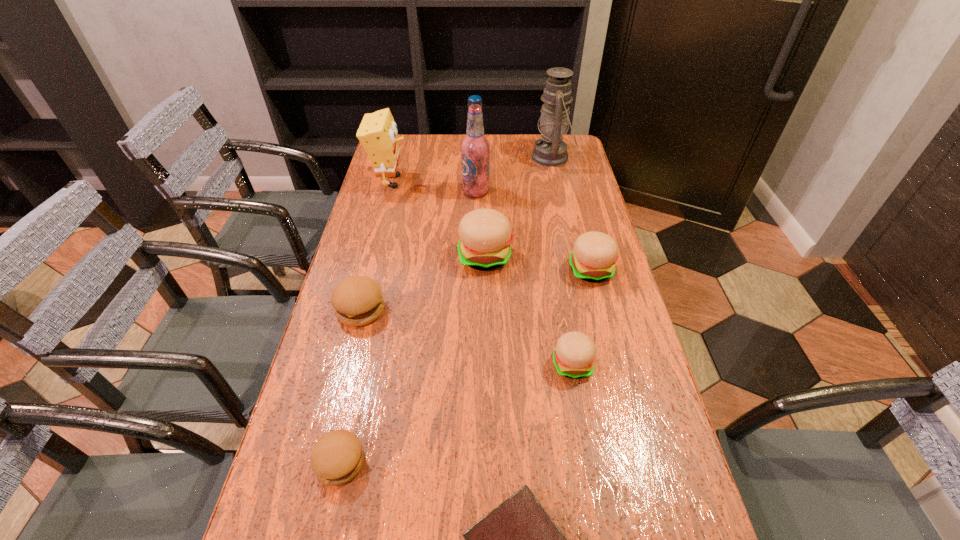
The image size is (960, 540). I want to click on vacant space located 0.080m on the left of the smallest beige hamburger, so click(x=518, y=364).

Locate an element on the screen. The image size is (960, 540). vacant region located 0.080m on the right of the nearer brown hamburger is located at coordinates (404, 462).

Identify the location of object that is at the far edge. This screenshot has width=960, height=540. (551, 151).

Locate an element on the screen. This screenshot has width=960, height=540. sponge located in the left edge section of the desktop is located at coordinates (377, 133).

You are a GUI agent. You are given a task and a screenshot of the screen. Output one action in this format:
    pyautogui.click(x=<x>, y=<y>)
    Task: Click on the oil lamp that is at the right edge
    This screenshot has width=960, height=540.
    Given the screenshot: What is the action you would take?
    pyautogui.click(x=551, y=151)

The height and width of the screenshot is (540, 960). Find the location of `object located in the far right corner section of the desktop`. object located in the far right corner section of the desktop is located at coordinates (551, 151).

Locate an element on the screen. The image size is (960, 540). free space at the far edge of the desktop is located at coordinates (516, 149).

This screenshot has width=960, height=540. Find the location of `vacant space at the left edge of the desktop`. vacant space at the left edge of the desktop is located at coordinates (400, 171).

You are a GUI agent. You are given a task and a screenshot of the screen. Output one action in this format:
    pyautogui.click(x=<x>, y=<y>)
    Task: Click on the free location at the right edge
    
    Given the screenshot: What is the action you would take?
    coord(564,221)

In the image, there is a desktop. Where is `free space at the far left corner`? The image size is (960, 540). free space at the far left corner is located at coordinates (409, 158).